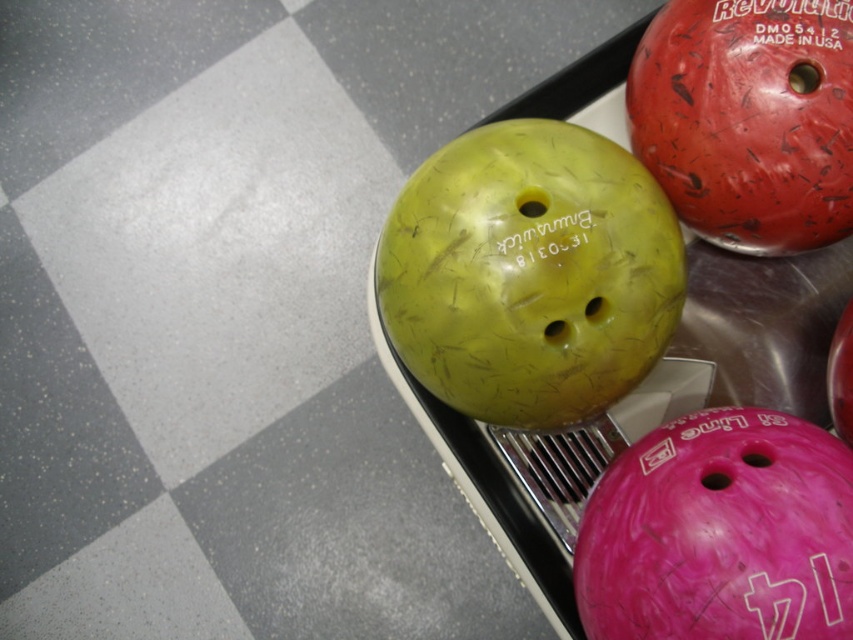
Question: Where is pink textured bowling ball at center located in relation to red textured bowling ball at upper right in the image?

Choices:
 (A) left
 (B) right

Answer: (A)

Question: Is yellow-green textured bowling ball at center above red textured bowling ball at upper right?

Choices:
 (A) yes
 (B) no

Answer: (B)

Question: Estimate the real-world distances between objects in this image. Which object is closer to the red textured bowling ball at upper right?

Choices:
 (A) pink textured bowling ball at center
 (B) yellow-green textured bowling ball at center

Answer: (B)

Question: Which object appears farthest from the camera in this image?

Choices:
 (A) yellow-green textured bowling ball at center
 (B) red textured bowling ball at upper right

Answer: (B)

Question: Which object appears farthest from the camera in this image?

Choices:
 (A) pink textured bowling ball at center
 (B) yellow-green textured bowling ball at center

Answer: (B)

Question: Does yellow-green textured bowling ball at center have a lesser width compared to red textured bowling ball at upper right?

Choices:
 (A) no
 (B) yes

Answer: (A)